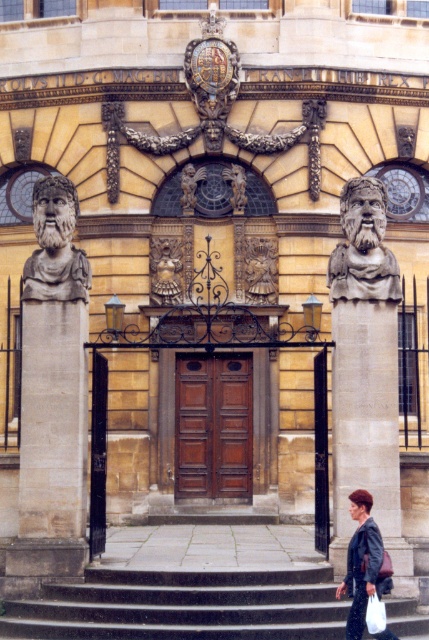
Does point (75, 294) lie behind point (151, 284)?

That is False.

Does polished stone bust at left appear under gold metallic statue at center?

No, polished stone bust at left is not below gold metallic statue at center.

Is point (54, 205) in front of point (169, 294)?

Yes, point (54, 205) is in front of point (169, 294).

Locate an element on the screen. polished stone bust at left is located at coordinates (56, 244).

Can you confirm if polished bronze statue at center is smaller than white plastic bag at lower right?

Yes.

Between point (271, 248) and point (374, 609), which one is positioned behind?

The point (271, 248) is behind.

You are a GUI agent. You are given a task and a screenshot of the screen. Output one action in this format:
    pyautogui.click(x=<x>, y=<y>)
    Task: Click on the polished bronze statue at center
    This screenshot has width=429, height=640.
    Given the screenshot: What is the action you would take?
    pyautogui.click(x=260, y=269)

Is gold metallic statue at center taller than polished bronze cherub at center?

No.

Between gold metallic statue at center and polished bronze cherub at center, which one has less height?

gold metallic statue at center

Between point (175, 301) and point (184, 166), which one is positioned in front?

Point (175, 301)

Locate an element on the screen. The width and height of the screenshot is (429, 640). gold metallic statue at center is located at coordinates (165, 269).